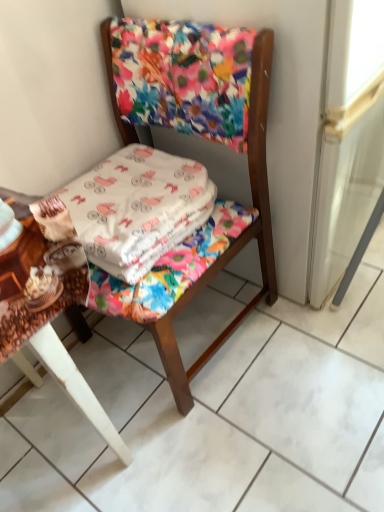
Find the location of `free space underneath floral fabric chair at center (from a real-world perspective)`. free space underneath floral fabric chair at center (from a real-world perspective) is located at coordinates (173, 333).